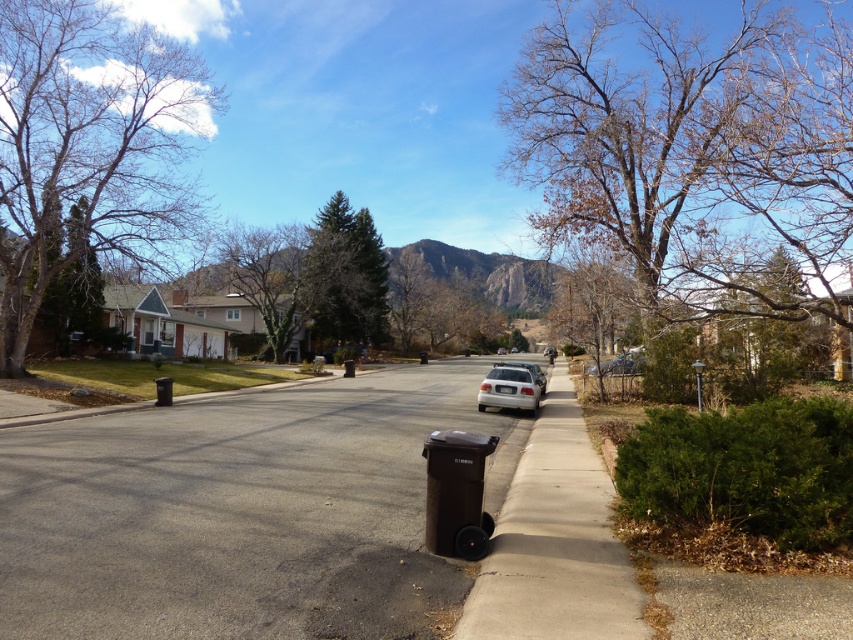
You are a delivery person driving a 1.8 meters tall truck and need to pass under the bare wood tree at right and the satin silver sedan at center. Which object will block your truck from passing through?

The bare wood tree at right is much taller than the satin silver sedan at center, so the truck will not be blocked by either object since both are taller than the truck.

Based on the photo, you are a delivery person trying to park your 2.5 meter wide delivery van on the street. You see the brown concrete curb at lower center and the green matte tree at center. Which object has enough space for the van to park next to it without overlapping?

The green matte tree at center has a greater width than the brown concrete curb at lower center, so the van can park next to the green matte tree at center since it provides more space.